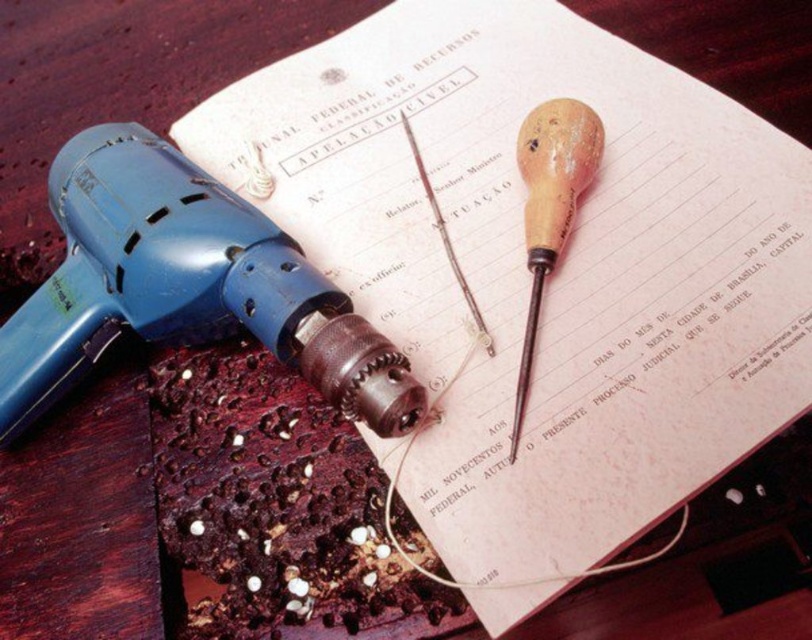
You are organizing tools on a workbench. You need to place a new tool between the blue plastic drill at left and the wooden handle screwdriver at center. Where should you place it to ensure it is between them?

Place the new tool to the right of the blue plastic drill at left but to the left of the wooden handle screwdriver at center since the blue plastic drill at left is positioned to the left of the wooden handle screwdriver at center.

You are a carpenter working on a project and need to reach both the blue plastic drill at left and the wooden handle screwdriver at center. If your arm can extend 15 inches, can you grab both tools without moving your body?

The blue plastic drill at left is 16.36 inches away from the wooden handle screwdriver at center. Since your arm can only extend 15 inches, you cannot reach both tools simultaneously without moving your body.